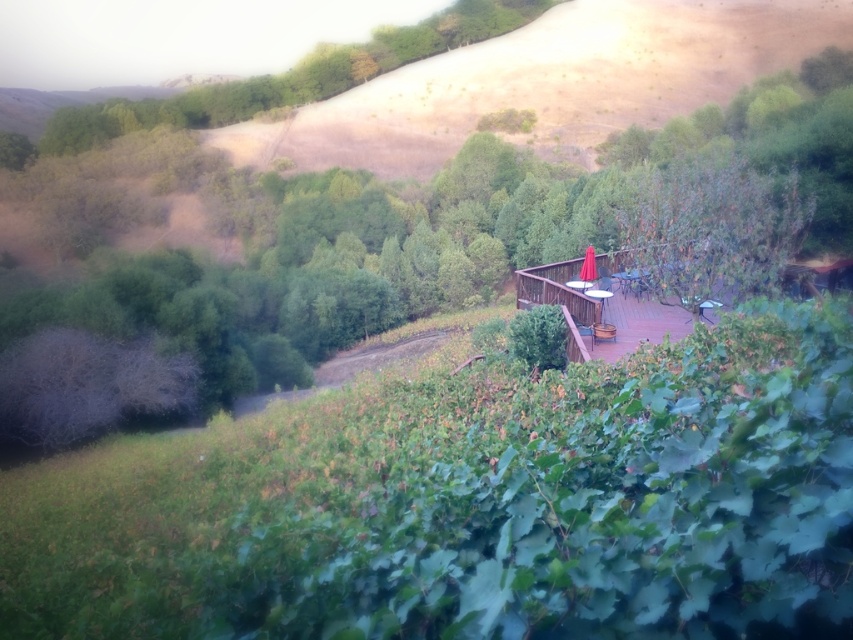
You are standing on the wooden deck and looking towards the green leafy tree at center and the green leafy tree at upper center. Which tree is closer to you?

The green leafy tree at center is closer to you because it is positioned in front of the green leafy tree at upper center.